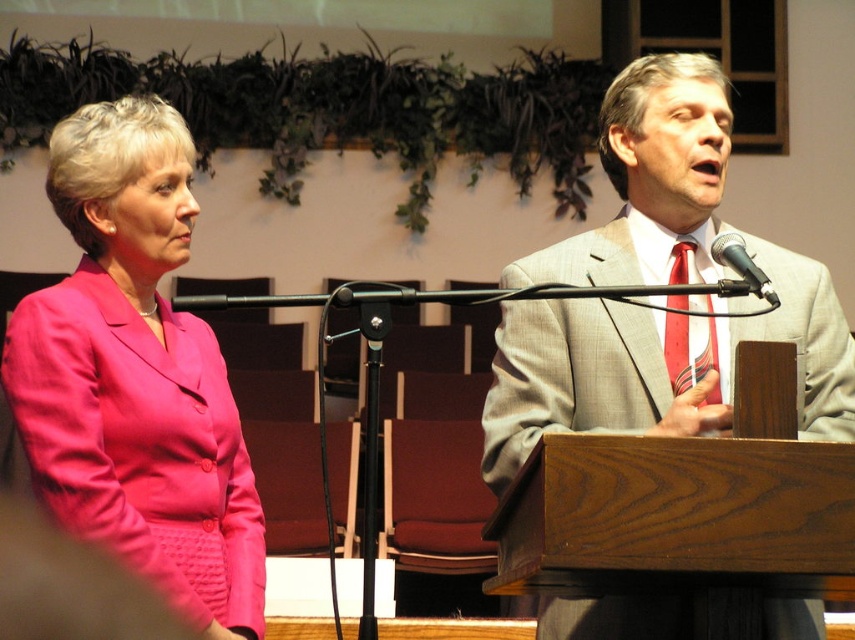
Question: Which object appears farthest from the camera in this image?

Choices:
 (A) black metallic microphone at upper right
 (B) gray textured suit at center
 (C) striped silk tie at right
 (D) matte pink suit at left

Answer: (D)

Question: Does matte pink suit at left appear under gray textured suit at center?

Choices:
 (A) yes
 (B) no

Answer: (A)

Question: Which of the following is the closest to the observer?

Choices:
 (A) (582, 336)
 (B) (671, 346)

Answer: (B)

Question: Does gray textured suit at center have a larger size compared to black metallic microphone at upper right?

Choices:
 (A) no
 (B) yes

Answer: (B)

Question: Observing the image, what is the correct spatial positioning of matte pink suit at left in reference to striped silk tie at right?

Choices:
 (A) below
 (B) above

Answer: (A)

Question: Which point is closer to the camera?

Choices:
 (A) (665, 365)
 (B) (722, 246)

Answer: (B)